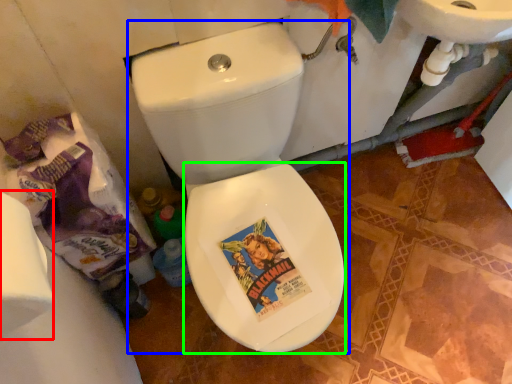
Question: Which object is positioned closest to toilet paper (highlighted by a red box)? Select from toilet (highlighted by a blue box) and bidet (highlighted by a green box).

Choices:
 (A) toilet
 (B) bidet

Answer: (A)